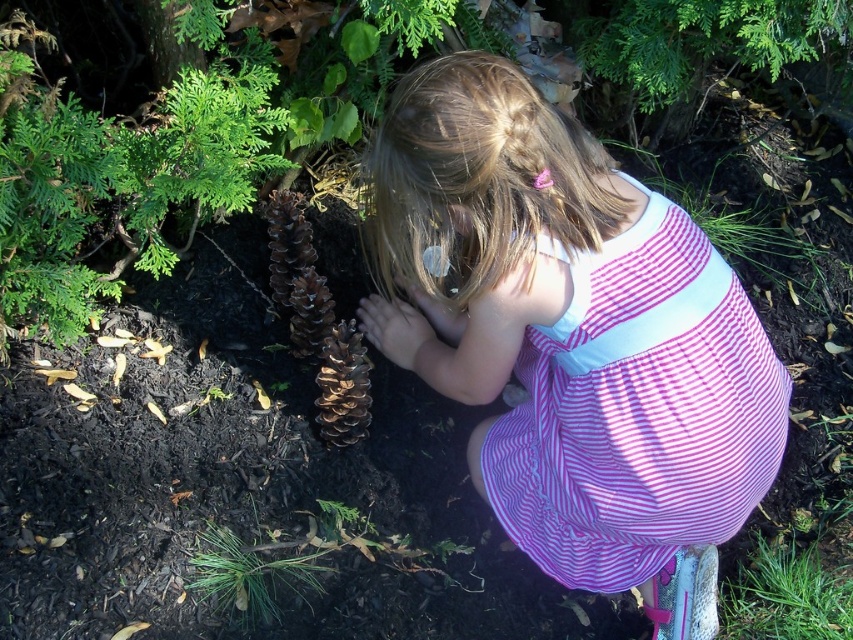
You are standing 1.2 meters away from the point marked at coordinates [485,180]. Can you reach that point without moving your feet?

The point marked at coordinates [485,180] is 1.19 meters from the viewer. Since you are standing 1.2 meters away from it, you can just barely reach it without moving your feet.

The young girl is wearing a pink striped dress at center and there is a brown matte pine cone at center in front of her. If she wants to pick up the pine cone without moving her feet, can she reach it?

The pink striped dress at center is 15.21 inches away from the brown matte pine cone at center. Since the distance is about 15 inches, the girl can likely reach the pine cone without moving her feet as most people can reach about 15 inches comfortably.